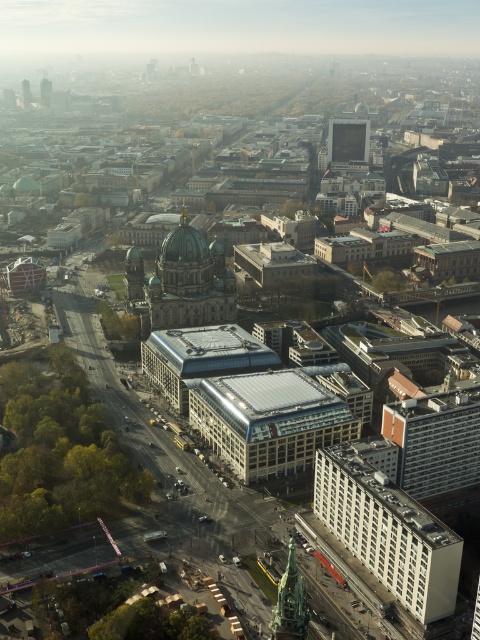
Based on the photo, between glassy reflective building at center and matte glass skyscraper at upper center, which one appears on the left side from the viewer's perspective?

Positioned to the left is glassy reflective building at center.

Can you confirm if glassy reflective building at center is wider than matte glass skyscraper at upper center?

Yes, glassy reflective building at center is wider than matte glass skyscraper at upper center.

Does point (204, 413) come in front of point (364, 125)?

Yes, point (204, 413) is closer to viewer.

This screenshot has width=480, height=640. What are the coordinates of `glassy reflective building at center` in the screenshot? It's located at (268, 420).

Between orange brick building at lower right and green glass tower at upper left, which one has more height?

With more height is orange brick building at lower right.

Where is `orange brick building at lower right`? The width and height of the screenshot is (480, 640). orange brick building at lower right is located at coordinates (436, 445).

Who is more distant from viewer, (470, 433) or (48, 104)?

The point (48, 104) is more distant.

I want to click on orange brick building at lower right, so click(x=436, y=445).

Between glassy reflective building at center and bronze statue at lower center, which one appears on the left side from the viewer's perspective?

Positioned to the left is glassy reflective building at center.

Which is behind, point (220, 436) or point (277, 589)?

Positioned behind is point (220, 436).

You are a GUI agent. You are given a task and a screenshot of the screen. Output one action in this format:
    pyautogui.click(x=<x>, y=<y>)
    Task: Click on the glassy reflective building at center
    The width and height of the screenshot is (480, 640).
    Given the screenshot: What is the action you would take?
    pyautogui.click(x=268, y=420)